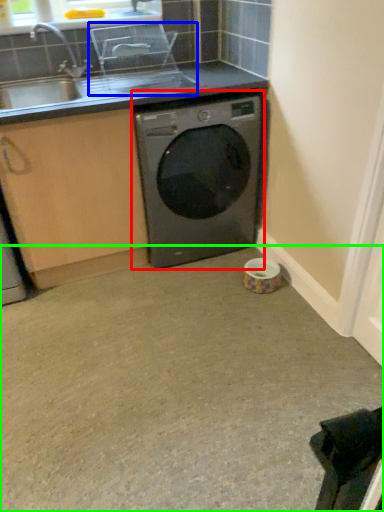
Question: Which object is positioned farthest from washing machine (highlighted by a red box)? Select from appliance (highlighted by a blue box) and concrete (highlighted by a green box).

Choices:
 (A) appliance
 (B) concrete

Answer: (B)